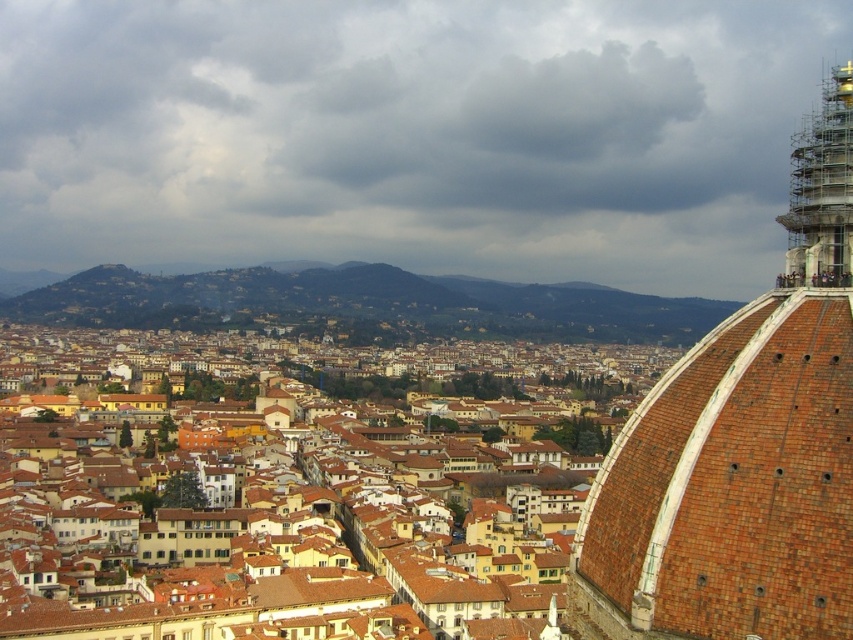
Consider the image. You are standing in the city square and want to take a photo of the red brick dome at right. If your camera has a maximum focus range of 60 meters, will you be able to capture the dome clearly?

The red brick dome at right is 66.07 meters away from the viewer. Since the camera can only focus up to 60 meters, it won cannot capture the dome clearly at this distance.

In the scene shown: You are standing in the city square looking towards the dome. Which object is closer to the left side of your view? The red brick dome at right or the scaffolding metal spire at upper right?

The red brick dome at right is to the left of the scaffolding metal spire at upper right, so the red brick dome at right is closer to the left side of your view.

You are an architect visiting Florence and notice the red brick dome at right and the scaffolding metal spire at upper right. Which structure appears larger in the image?

The scaffolding metal spire at upper right appears larger than the red brick dome at right in the image.